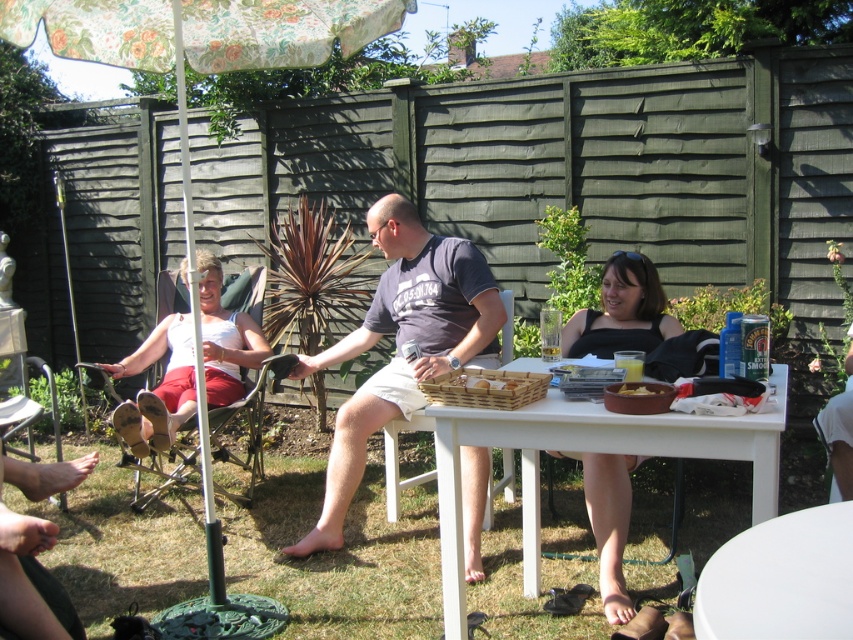
You are planning to place a small decorative item on the table. Given the sizes of the metallic silver chair at left and the yellow matte bowl at lower center, which object would be more suitable to place the item next to?

The yellow matte bowl at lower center would be more suitable to place the item next to because it is smaller than the metallic silver chair at left, allowing for more space around it.

You are planning to set up a small table under the floral fabric umbrella at upper left and the white plastic chair at center for a guest. Which object should you place first to ensure there is enough space for both?

You should place the white plastic chair at center first because the floral fabric umbrella at upper left is bigger and requires more space, so positioning the smaller chair first allows room for the larger umbrella afterward.